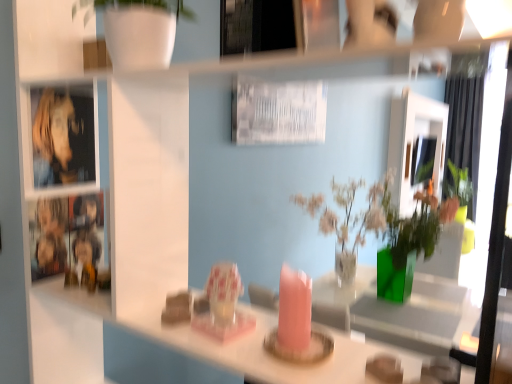
Question: From a real-world perspective, is matte white mirror at upper center on green fabric curtain at right?

Choices:
 (A) no
 (B) yes

Answer: (B)

Question: From the image's perspective, would you say matte white mirror at upper center is shown under green fabric curtain at right?

Choices:
 (A) yes
 (B) no

Answer: (B)

Question: Is matte white mirror at upper center at the right side of green fabric curtain at right?

Choices:
 (A) no
 (B) yes

Answer: (A)

Question: Is matte white mirror at upper center closer to the viewer compared to green fabric curtain at right?

Choices:
 (A) yes
 (B) no

Answer: (A)

Question: Can you confirm if matte white mirror at upper center is smaller than green fabric curtain at right?

Choices:
 (A) no
 (B) yes

Answer: (B)

Question: From the image's perspective, is metallic silver picture frame at upper center located above or below green fabric curtain at right?

Choices:
 (A) below
 (B) above

Answer: (A)

Question: In the image, is metallic silver picture frame at upper center positioned in front of or behind green fabric curtain at right?

Choices:
 (A) behind
 (B) front

Answer: (B)

Question: Would you say metallic silver picture frame at upper center is inside or outside green fabric curtain at right?

Choices:
 (A) outside
 (B) inside

Answer: (A)

Question: From their relative heights in the image, would you say metallic silver picture frame at upper center is taller or shorter than green fabric curtain at right?

Choices:
 (A) tall
 (B) short

Answer: (B)

Question: Is point (266, 9) positioned closer to the camera than point (82, 165)?

Choices:
 (A) closer
 (B) farther

Answer: (A)

Question: Is metallic silver picture frame at upper center inside or outside of metallic reflective cabinet at left?

Choices:
 (A) outside
 (B) inside

Answer: (A)

Question: Is metallic silver picture frame at upper center in front of or behind metallic reflective cabinet at left in the image?

Choices:
 (A) behind
 (B) front

Answer: (B)

Question: From the image's perspective, relative to metallic reflective cabinet at left, is metallic silver picture frame at upper center above or below?

Choices:
 (A) below
 (B) above

Answer: (B)

Question: Looking at their shapes, would you say green fabric curtain at right is wider or thinner than metallic reflective cabinet at left?

Choices:
 (A) thin
 (B) wide

Answer: (B)

Question: Considering the relative positions of green fabric curtain at right and metallic reflective cabinet at left in the image provided, is green fabric curtain at right to the left or to the right of metallic reflective cabinet at left?

Choices:
 (A) left
 (B) right

Answer: (B)